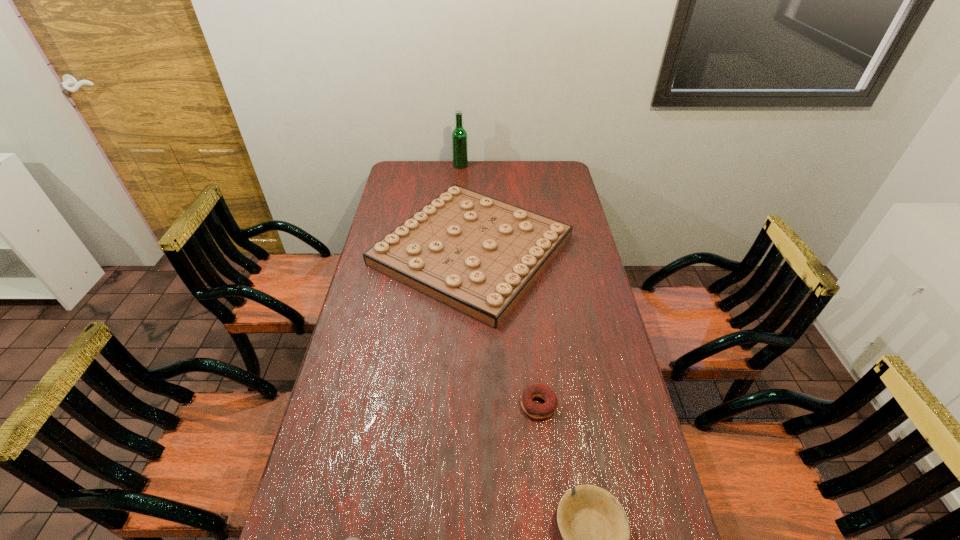
The image size is (960, 540). I want to click on the farthest object, so click(x=459, y=135).

This screenshot has height=540, width=960. Find the location of `beer bottle`. beer bottle is located at coordinates (459, 135).

Where is `gameboard`? gameboard is located at coordinates (479, 255).

Where is `the second farthest object`? The width and height of the screenshot is (960, 540). the second farthest object is located at coordinates (479, 255).

The height and width of the screenshot is (540, 960). I want to click on the shortest object, so click(538, 411).

At what (x,y) coordinates should I click in order to perform the action: click on doughnut. Please return your answer as a coordinate pair (x, y). This screenshot has height=540, width=960. Looking at the image, I should click on (538, 411).

Identify the location of free region located 0.330m on the front of the tallest object. (458, 206).

This screenshot has width=960, height=540. Identify the location of vacant space located 0.180m on the front of the third shortest object. (469, 374).

At what (x,y) coordinates should I click in order to perform the action: click on vacant space located on the back of the doughnut. Please return your answer as a coordinate pair (x, y). The height and width of the screenshot is (540, 960). Looking at the image, I should click on (530, 321).

The height and width of the screenshot is (540, 960). Identify the location of object situated at the far edge. (459, 135).